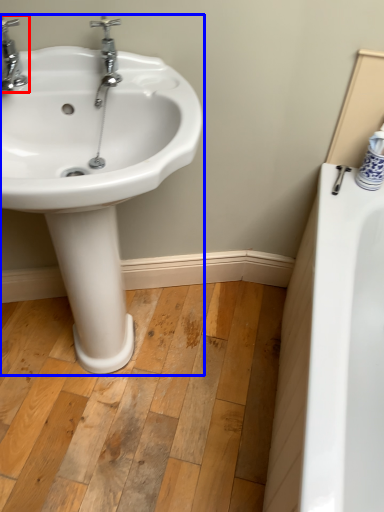
Question: Among these objects, which one is nearest to the camera, tap (highlighted by a red box) or sink (highlighted by a blue box)?

Choices:
 (A) tap
 (B) sink

Answer: (B)